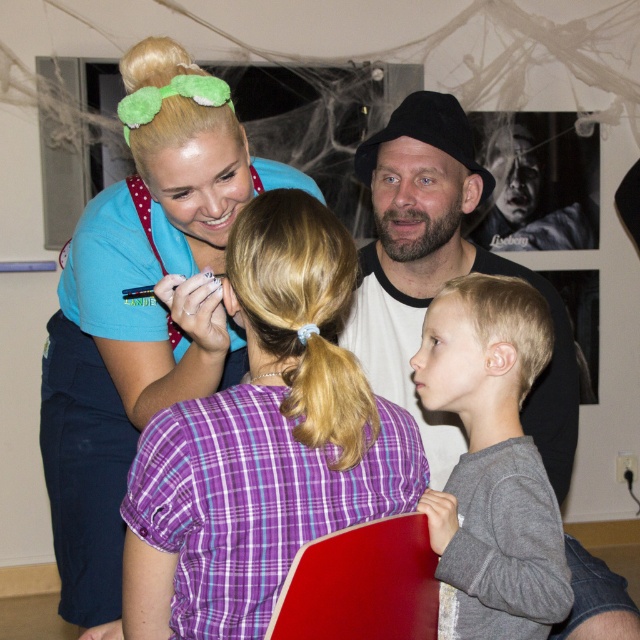
From the picture: Does blue scrubs at upper left have a greater width compared to green fuzzy headband at upper left?

Yes, blue scrubs at upper left is wider than green fuzzy headband at upper left.

Does blue scrubs at upper left have a greater height compared to green fuzzy headband at upper left?

Indeed, blue scrubs at upper left has a greater height compared to green fuzzy headband at upper left.

Is point (81, 536) more distant than point (202, 90)?

Yes, point (81, 536) is behind point (202, 90).

This screenshot has height=640, width=640. What are the coordinates of `blue scrubs at upper left` in the screenshot? It's located at (141, 307).

Find the location of a particular element. Image resolution: width=640 pixels, height=640 pixels. blue scrubs at upper left is located at coordinates (141, 307).

Between point (100, 472) and point (417, 276), which one is positioned behind?

The point (417, 276) is behind.

This screenshot has height=640, width=640. Identify the location of blue scrubs at upper left. (141, 307).

Find the location of a particular element. purple plaid shirt at center is located at coordinates (262, 440).